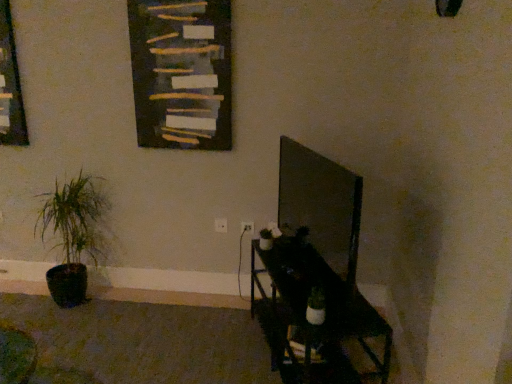
Question: Can you confirm if metallic black shelf at lower right is positioned to the left of dark wood bulletin board at upper center?

Choices:
 (A) no
 (B) yes

Answer: (A)

Question: Considering the relative sizes of metallic black shelf at lower right and dark wood bulletin board at upper center in the image provided, is metallic black shelf at lower right wider than dark wood bulletin board at upper center?

Choices:
 (A) yes
 (B) no

Answer: (A)

Question: Does metallic black shelf at lower right have a smaller size compared to dark wood bulletin board at upper center?

Choices:
 (A) yes
 (B) no

Answer: (B)

Question: Is metallic black shelf at lower right next to dark wood bulletin board at upper center?

Choices:
 (A) no
 (B) yes

Answer: (A)

Question: Would you say metallic black shelf at lower right is a long distance from dark wood bulletin board at upper center?

Choices:
 (A) no
 (B) yes

Answer: (B)

Question: Is metallic black shelf at lower right at the right side of dark wood bulletin board at upper center?

Choices:
 (A) yes
 (B) no

Answer: (A)

Question: Is dark wood bulletin board at upper center positioned behind wooden frame at left?

Choices:
 (A) yes
 (B) no

Answer: (B)

Question: Is dark wood bulletin board at upper center wider than wooden frame at left?

Choices:
 (A) no
 (B) yes

Answer: (A)

Question: Considering the relative sizes of dark wood bulletin board at upper center and wooden frame at left in the image provided, is dark wood bulletin board at upper center bigger than wooden frame at left?

Choices:
 (A) no
 (B) yes

Answer: (B)

Question: Could you tell me if dark wood bulletin board at upper center is turned towards wooden frame at left?

Choices:
 (A) yes
 (B) no

Answer: (B)

Question: Are dark wood bulletin board at upper center and wooden frame at left far apart?

Choices:
 (A) yes
 (B) no

Answer: (A)

Question: Considering the relative sizes of dark wood bulletin board at upper center and wooden frame at left in the image provided, is dark wood bulletin board at upper center taller than wooden frame at left?

Choices:
 (A) no
 (B) yes

Answer: (A)

Question: Is dark wood bulletin board at upper center smaller than green matte plant at left?

Choices:
 (A) yes
 (B) no

Answer: (A)